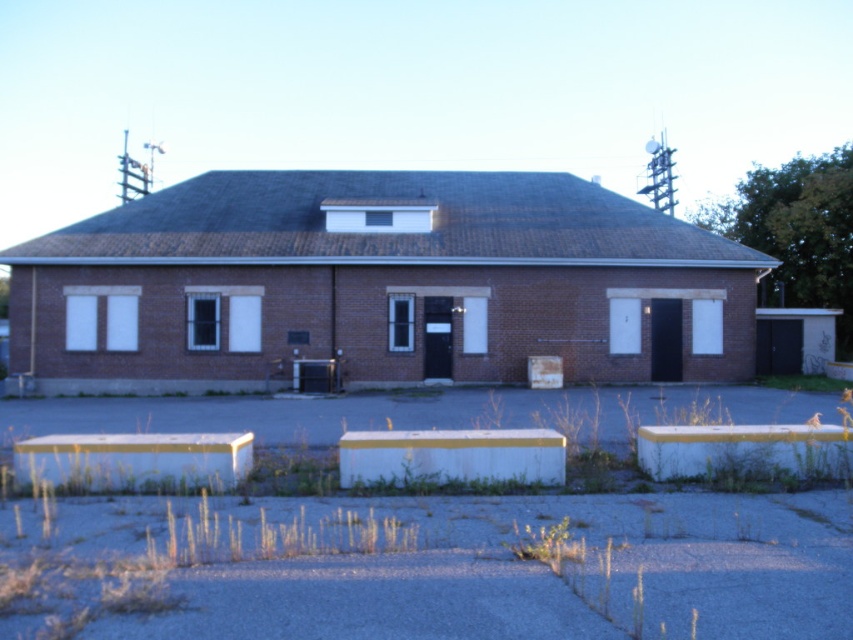
You are a delivery person trying to park your 2.5 meter wide truck. You see the brown brick building at center and the white concrete curb at lower right. Which object is wider, and can you safely park your truck next to the curb without hitting the building?

The brown brick building at center might be wider than the white concrete curb at lower right. However, since the curb itself is likely narrow, parking the 2.5 meter wide truck next to it might be possible if there is sufficient space between the curb and the building. However, without exact measurements, it is uncertain if the truck will fit without hitting the building.

You are a delivery driver who needs to park your truck at the white concrete curb at lower right. Your truck is 18 meters long. Can you safely park your truck there without it extending beyond the brown brick building at center?

The brown brick building at center is 20.38 meters away from the white concrete curb at lower right. Since your truck is 18 meters long, it can be parked there safely as the distance between them is sufficient to accommodate the truck length without overextending.